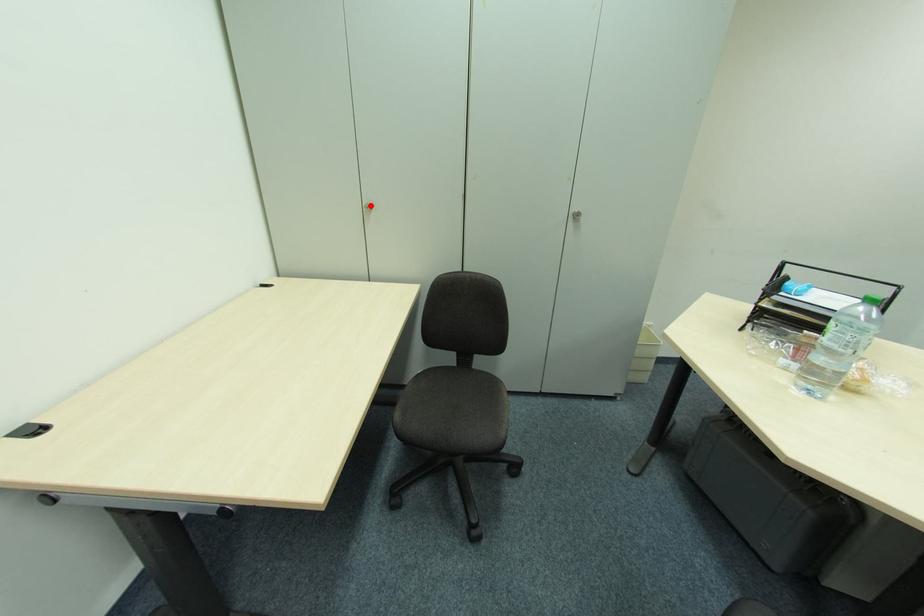
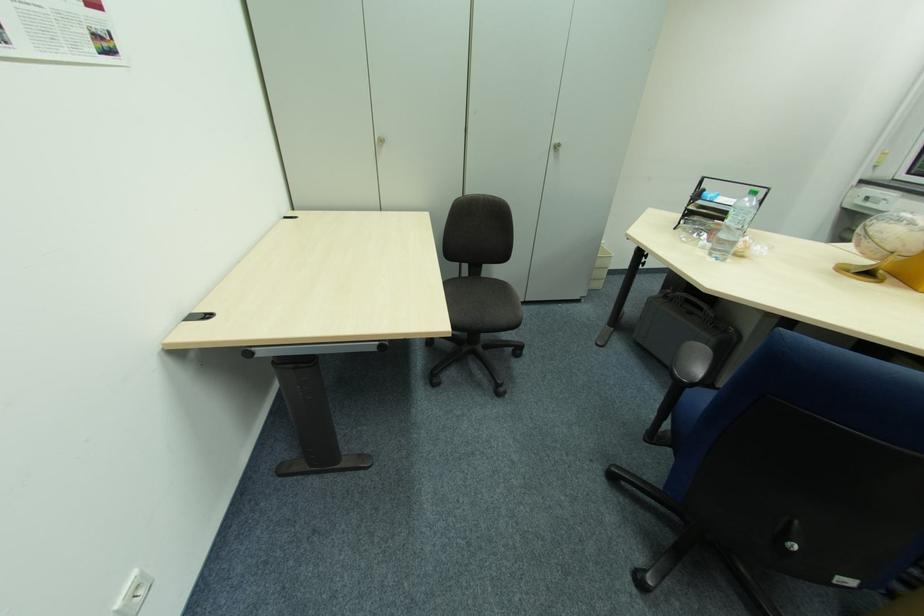
In the second image, find the point that corresponds to the highlighted location in the first image.

(382, 139)